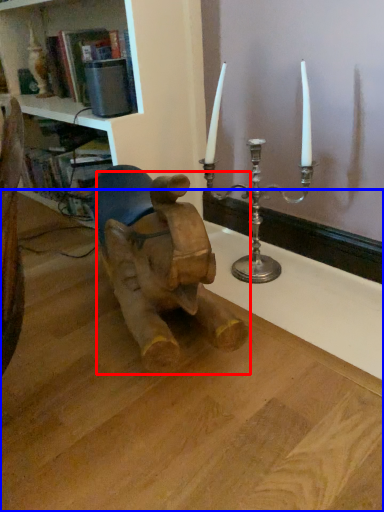
Question: Which point is closer to the camera, baby elephant (highlighted by a red box) or table (highlighted by a blue box)?

Choices:
 (A) baby elephant
 (B) table

Answer: (B)